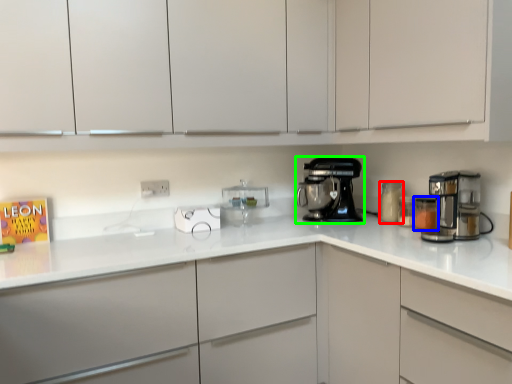
Question: Estimate the real-world distances between objects in this image. Which object is farther from kitchen appliance (highlighted by a red box), kitchen appliance (highlighted by a blue box) or home appliance (highlighted by a green box)?

Choices:
 (A) kitchen appliance
 (B) home appliance

Answer: (B)